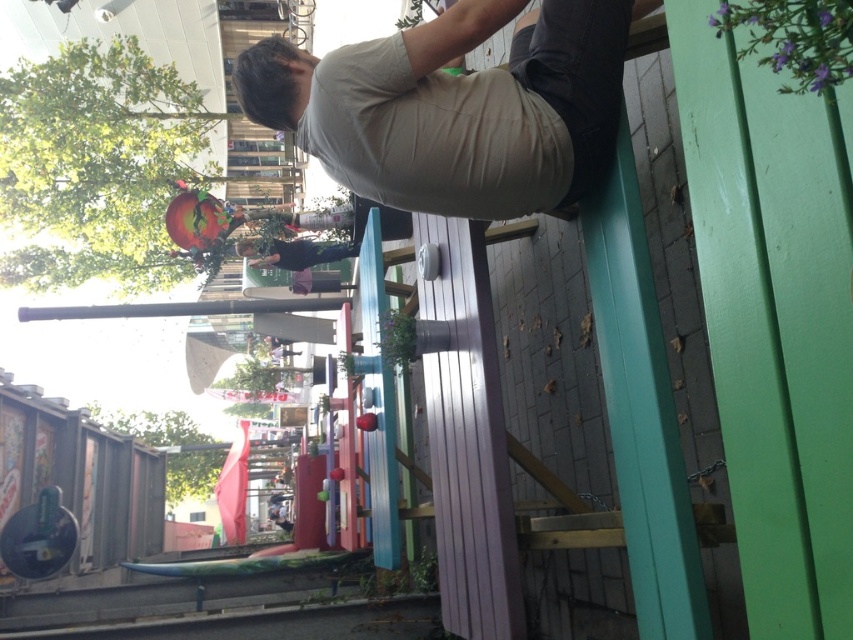
Question: Does beige cotton shirt at upper center appear over matte black shirt at center?

Choices:
 (A) yes
 (B) no

Answer: (A)

Question: Which object appears closest to the camera in this image?

Choices:
 (A) matte black shirt at center
 (B) beige cotton shirt at upper center

Answer: (B)

Question: Among these points, which one is nearest to the camera?

Choices:
 (A) (392, 84)
 (B) (241, 252)

Answer: (A)

Question: Can you confirm if beige cotton shirt at upper center is positioned to the right of matte black shirt at center?

Choices:
 (A) yes
 (B) no

Answer: (A)

Question: Is beige cotton shirt at upper center thinner than matte black shirt at center?

Choices:
 (A) no
 (B) yes

Answer: (A)

Question: Which object is farther from the camera taking this photo?

Choices:
 (A) beige cotton shirt at upper center
 (B) matte black shirt at center

Answer: (B)